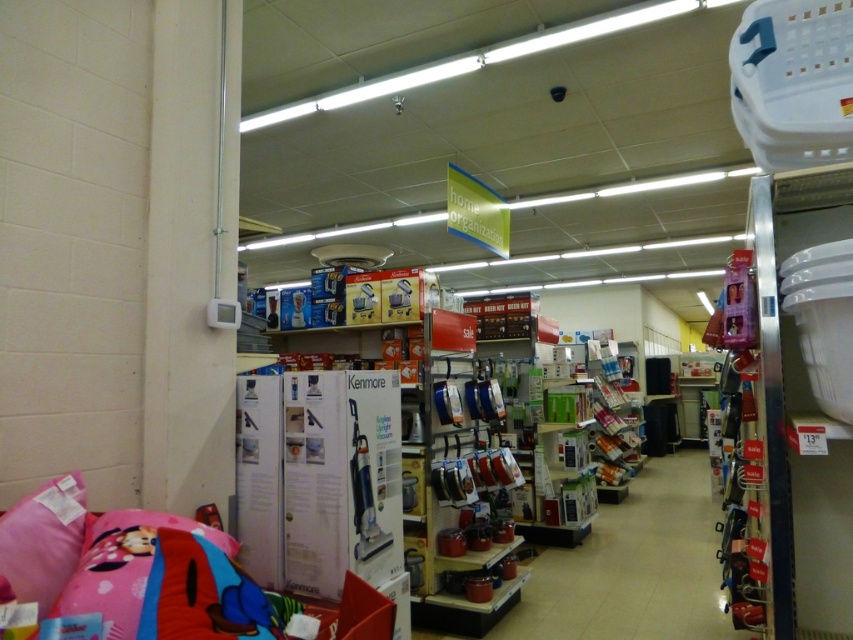
You are standing in the retail store and want to find the matte pink pillow at lower left. According to the store layout, where should you look relative to the Kenmore vacuum cleaner display?

The matte pink pillow at lower left is located at point (x=164, y=580), which is to the left side of the Kenmore vacuum cleaner display.